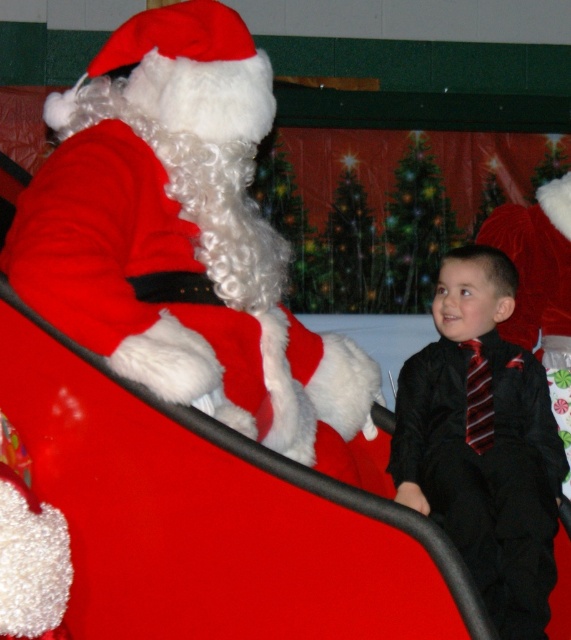
Question: Can you confirm if velvet red santa at upper left is positioned above black satin suit at right?

Choices:
 (A) yes
 (B) no

Answer: (A)

Question: Considering the relative positions of velvet red santa at upper left and black satin suit at right in the image provided, where is velvet red santa at upper left located with respect to black satin suit at right?

Choices:
 (A) right
 (B) left

Answer: (B)

Question: Is velvet red santa at upper left below black satin suit at right?

Choices:
 (A) yes
 (B) no

Answer: (B)

Question: Which object appears farthest from the camera in this image?

Choices:
 (A) black satin suit at right
 (B) velvet red santa at upper left

Answer: (A)